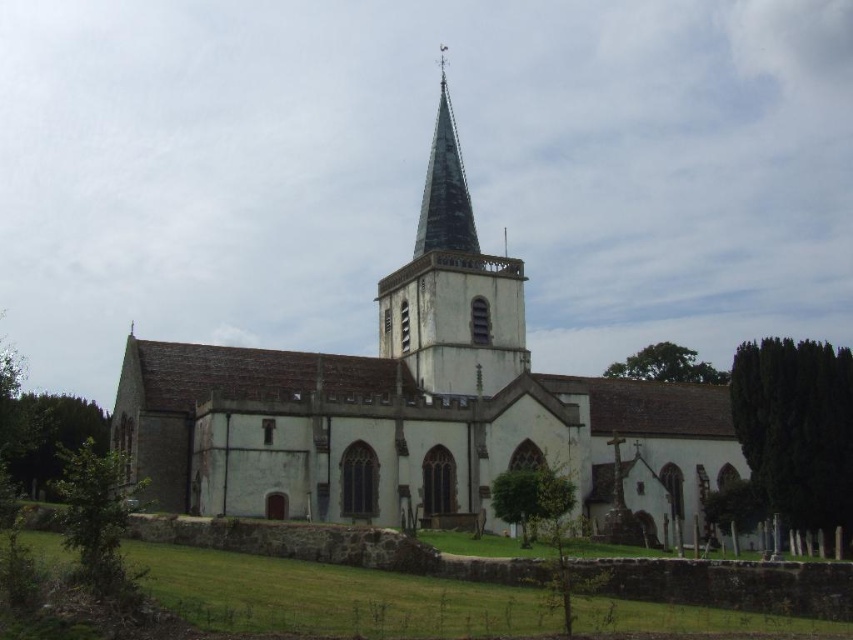
You are standing in front of the church and notice two points marked on the building. One is at coordinate point [665,410] and the other at point [453,140]. Which point is closer to you?

Point [453,140] is closer to you because it is less further to the camera than point [665,410].